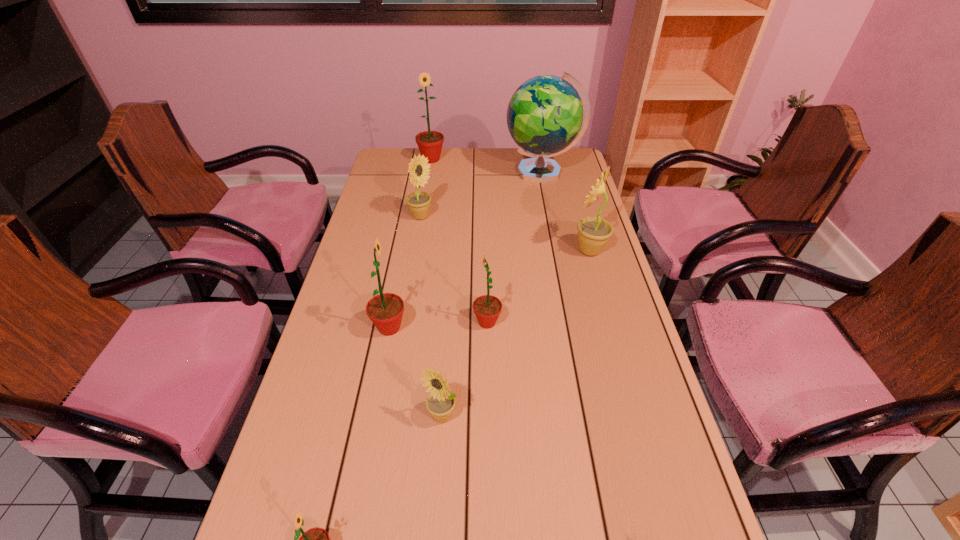
The height and width of the screenshot is (540, 960). I want to click on the smallest yellow sunflower, so click(440, 403).

The width and height of the screenshot is (960, 540). I want to click on the seventh farthest object, so click(x=440, y=403).

You are a GUI agent. You are given a task and a screenshot of the screen. Output one action in this format:
    pyautogui.click(x=<x>, y=<y>)
    Task: Click on the free space located 0.220m on the front surface of the blue globe
    The width and height of the screenshot is (960, 540).
    Given the screenshot: What is the action you would take?
    pyautogui.click(x=450, y=172)

The width and height of the screenshot is (960, 540). I want to click on vacant area situated 0.120m on the front surface of the blue globe, so click(474, 172).

Locate an element on the screen. The image size is (960, 540). vacant space located 0.400m on the front surface of the blue globe is located at coordinates point(405,172).

In order to click on vacant area situated 0.100m on the face of the farthest green sunflower in this screenshot , I will do `click(428, 179)`.

Identify the location of free space located 0.050m on the face of the rightmost yellow sunflower. (556, 251).

Locate an element on the screen. vacant point located on the face of the rightmost yellow sunflower is located at coordinates (469, 251).

The width and height of the screenshot is (960, 540). In order to click on free space located 0.160m on the face of the rightmost yellow sunflower in this screenshot , I will do `click(522, 251)`.

The width and height of the screenshot is (960, 540). I want to click on free point located 0.250m on the face of the second biggest green sunflower, so click(501, 328).